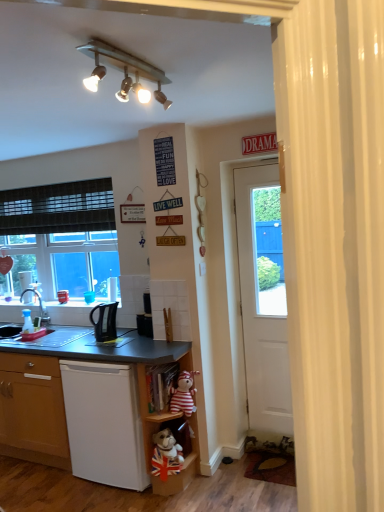
Question: Is matte black sink at lower left, the 1th sink from the left, spatially inside black plastic kettle at lower left, or outside of it?

Choices:
 (A) outside
 (B) inside

Answer: (A)

Question: In terms of height, does matte black sink at lower left, the 1th sink from the left, look taller or shorter compared to black plastic kettle at lower left?

Choices:
 (A) short
 (B) tall

Answer: (A)

Question: Estimate the real-world distances between objects in this image. Which object is closer to the matte black desk at lower left?

Choices:
 (A) white matte door at right
 (B) striped fabric teddy bear at lower center
 (C) matte black sink at lower left, the second sink viewed from the right
 (D) wooden bookshelf at lower center, which appears as the 1th shelf when viewed from the top
 (E) black plastic kettle at lower left

Answer: (E)

Question: Estimate the real-world distances between objects in this image. Which object is farther from the striped fabric teddy bear at lower center?

Choices:
 (A) matte black sink at lower left, the 1th sink from the left
 (B) white matte door at right
 (C) metallic track lighting at upper center
 (D) white matte dishwasher at lower left
 (E) black plastic kettle at lower left

Answer: (C)